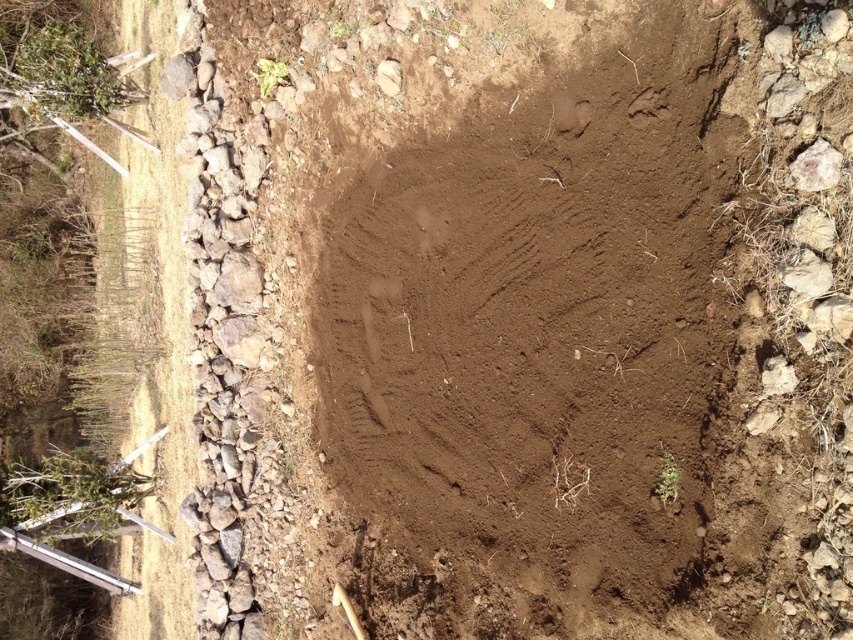
Is point (665, 378) positioned behind point (799, 262)?

Yes, it is behind point (799, 262).

From the picture: Which of these two, brown soil at center or gray rock at right, stands shorter?

gray rock at right

Is point (602, 481) positioned in front of point (802, 284)?

No, it is not.

Locate an element on the screen. brown soil at center is located at coordinates [x=538, y=339].

Is brown rough rock at upper right wider than gray rock at right?

In fact, brown rough rock at upper right might be narrower than gray rock at right.

Between point (825, 182) and point (809, 284), which one is positioned behind?

The point (809, 284) is behind.

This screenshot has height=640, width=853. Identify the location of brown rough rock at upper right. (816, 168).

Does brown soil at center lie in front of brown rough rock at upper right?

No, brown soil at center is behind brown rough rock at upper right.

Does point (412, 410) come farther from viewer compared to point (817, 189)?

Yes.

I want to click on brown soil at center, so click(538, 339).